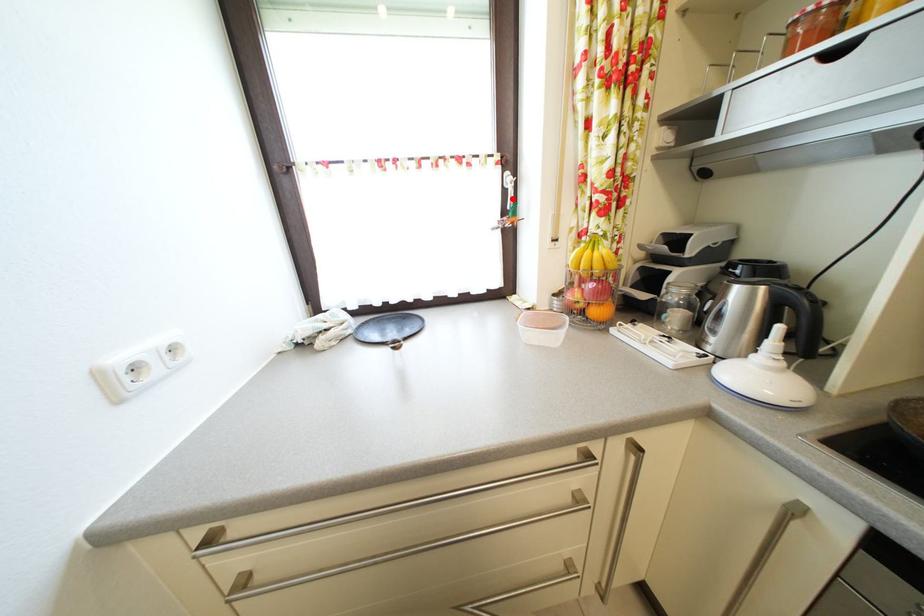
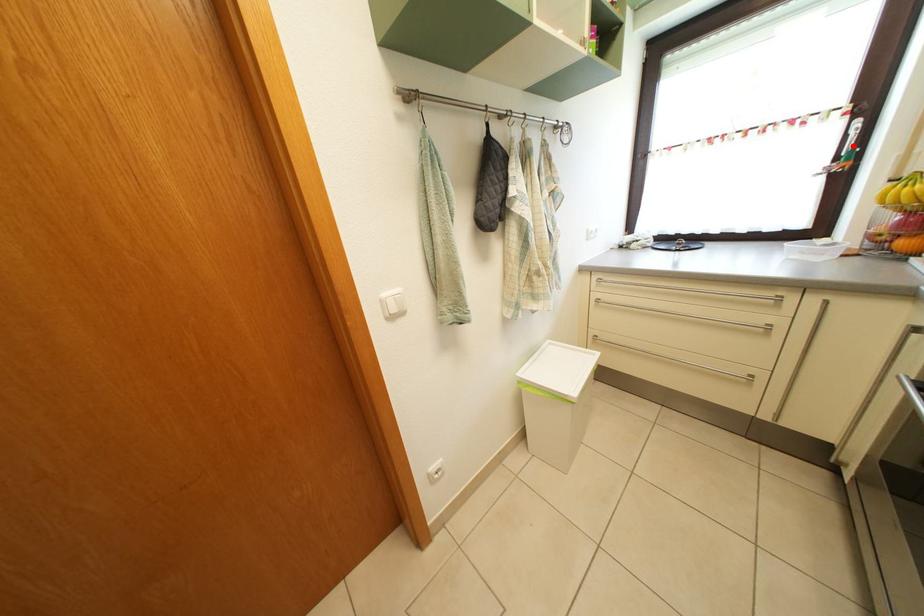
I am providing you with two images of the same scene from different viewpoints. A red point is marked on the first image and another point is marked on the second image. Is the marked point in image1 the same physical position as the marked point in image2?

Yes